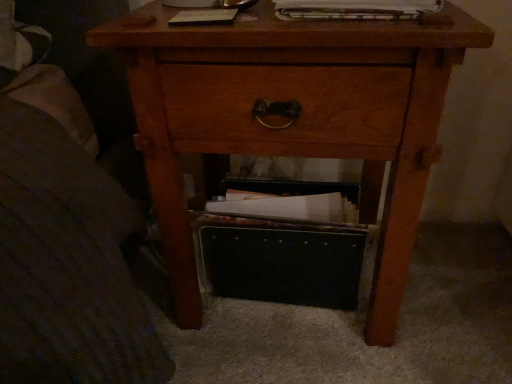
Question: From their relative heights in the image, would you say printed paper magazine at upper center is taller or shorter than black leather shoe box at lower center?

Choices:
 (A) short
 (B) tall

Answer: (A)

Question: From the image's perspective, is printed paper magazine at upper center located above or below black leather shoe box at lower center?

Choices:
 (A) below
 (B) above

Answer: (B)

Question: Which object is the closest to the wooden nightstand at center?

Choices:
 (A) black leather shoe box at lower center
 (B) printed paper magazine at upper center

Answer: (A)

Question: Considering the real-world distances, which object is farthest from the black leather shoe box at lower center?

Choices:
 (A) wooden nightstand at center
 (B) printed paper magazine at upper center

Answer: (B)